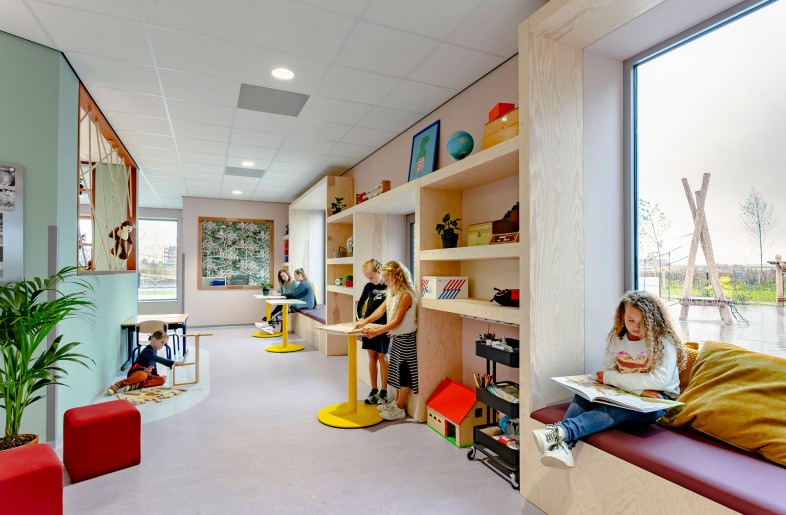
The image size is (786, 515). In order to click on vase in this screenshot , I will do `click(446, 233)`.